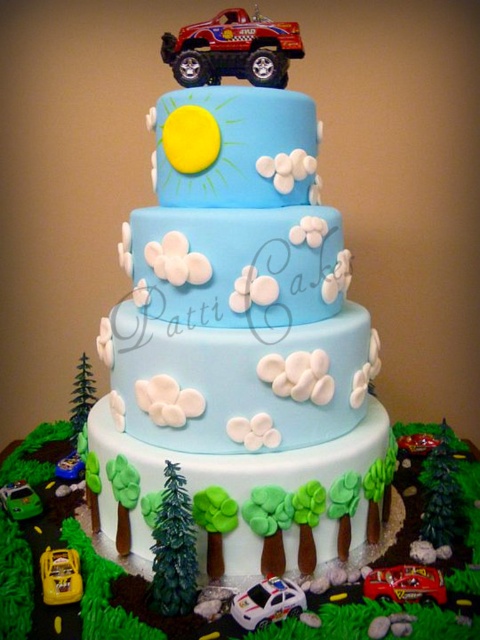
You are a guest at a birthday party and want to take a photo of both the blue fondant truck at upper center and the metallic silver car at lower left without any obstruction. Based on their positions, which object should you focus on first to ensure both are in the frame?

The blue fondant truck at upper center is above the metallic silver car at lower left, so you should focus on the blue fondant truck at upper center first to ensure both are in the frame.

Consider the image. You are a guest at a birthday party and want to take a photo of the cake. The photographer asks you to identify the position of the white glossy police car at lower center relative to the metallic red car at center. What do you tell them?

The white glossy police car at lower center is in front of the metallic red car at center.

You are a guest at a birthday party and want to take a photo of the cake. The photographer asks you to point to the blue fondant truck at upper center and the metallic silver car at lower left. Which one is positioned to the right of the other?

The blue fondant truck at upper center is positioned to the right of the metallic silver car at lower left.